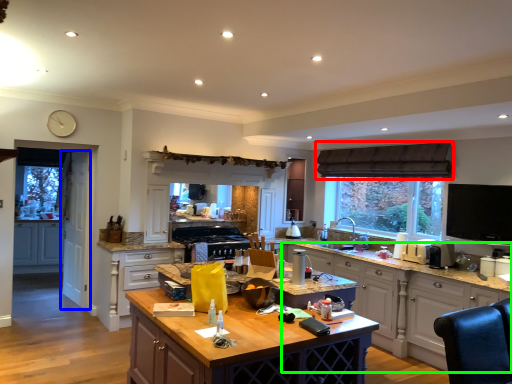
Question: Considering the real-world distances, which object is closest to exhaust hood (highlighted by a red box)? screen door (highlighted by a blue box) or cabinetry (highlighted by a green box).

Choices:
 (A) screen door
 (B) cabinetry

Answer: (B)